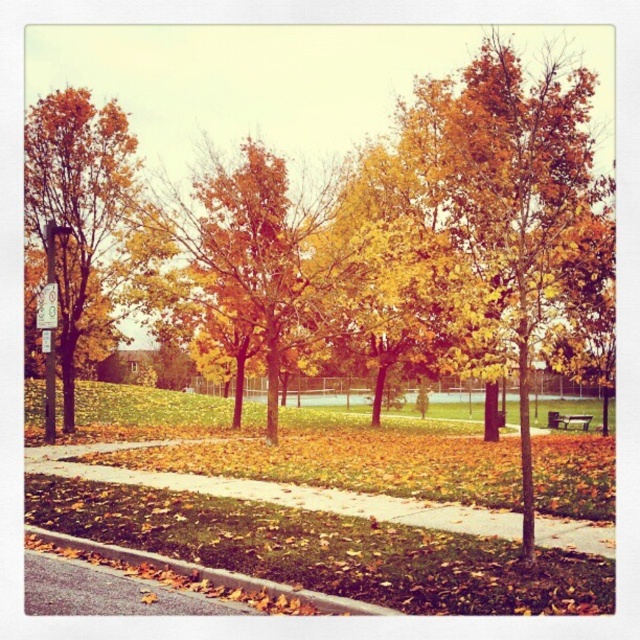
Question: Where is golden yellow leaves at left located in relation to brown asphalt curb at lower left in the image?

Choices:
 (A) right
 (B) left

Answer: (B)

Question: Which point appears closest to the camera in this image?

Choices:
 (A) (122, 608)
 (B) (552, 424)

Answer: (A)

Question: Is brown asphalt curb at lower left to the right of wooden park bench at center from the viewer's perspective?

Choices:
 (A) yes
 (B) no

Answer: (B)

Question: Which point is farther to the camera?

Choices:
 (A) wooden park bench at center
 (B) gray asphalt pavement at lower left

Answer: (A)

Question: Is gray asphalt pavement at lower left positioned in front of wooden park bench at center?

Choices:
 (A) no
 (B) yes

Answer: (B)

Question: Which of the following is the farthest from the observer?

Choices:
 (A) (134, 588)
 (B) (320, 596)

Answer: (A)